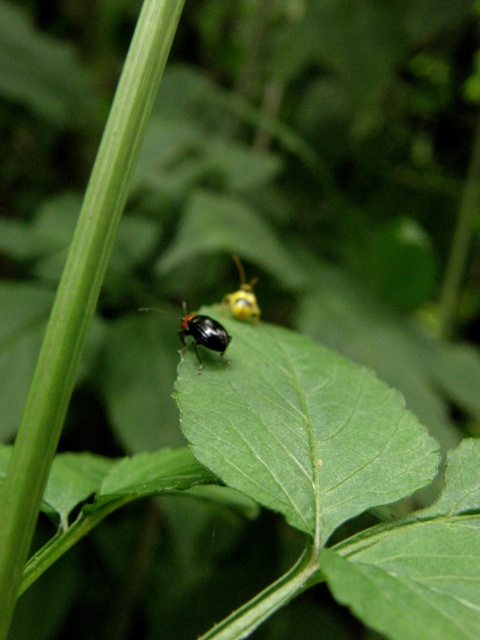
Does point (199, 368) come behind point (238, 291)?

No, (199, 368) is closer to viewer.

Which is below, black glossy beetle at center or yellow matte leaf beetle at center?

black glossy beetle at center is lower down.

Where is `black glossy beetle at center`? The width and height of the screenshot is (480, 640). black glossy beetle at center is located at coordinates (202, 333).